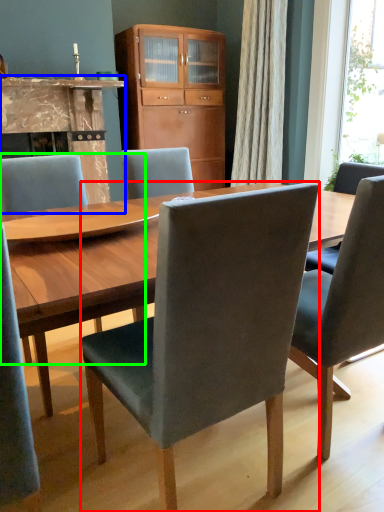
Question: Which is farther away from chair (highlighted by a red box)? fireplace (highlighted by a blue box) or chair (highlighted by a green box)?

Choices:
 (A) fireplace
 (B) chair

Answer: (A)